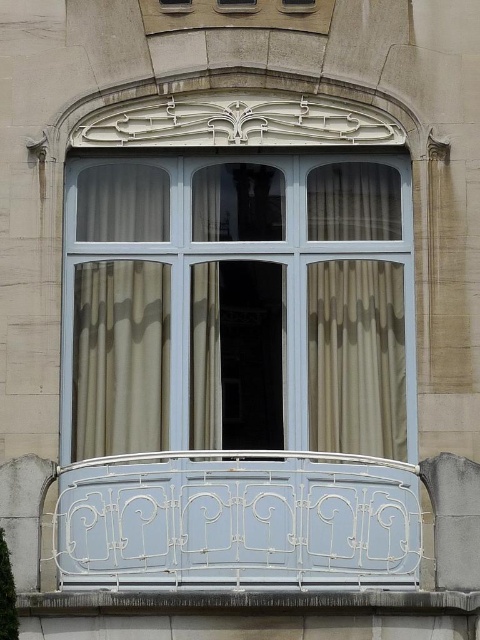
Looking at this image, does beige textured curtain at center have a larger size compared to beige sheer curtain at left?

Incorrect, beige textured curtain at center is not larger than beige sheer curtain at left.

Does beige textured curtain at center appear over beige sheer curtain at left?

Yes, beige textured curtain at center is above beige sheer curtain at left.

Does point (363, 291) come closer to viewer compared to point (113, 237)?

Yes, point (363, 291) is in front of point (113, 237).

Where is `beige textured curtain at center`? Image resolution: width=480 pixels, height=640 pixels. beige textured curtain at center is located at coordinates 357,356.

Between white wrought iron balcony at lower center and silky beige curtain at center, which one is positioned lower?

white wrought iron balcony at lower center is below.

Locate an element on the screen. Image resolution: width=480 pixels, height=640 pixels. white wrought iron balcony at lower center is located at coordinates (238, 518).

You are a GUI agent. You are given a task and a screenshot of the screen. Output one action in this format:
    pyautogui.click(x=<x>, y=<y>)
    Task: Click on the white wrought iron balcony at lower center
    The height and width of the screenshot is (640, 480).
    Given the screenshot: What is the action you would take?
    pyautogui.click(x=238, y=518)

Which is in front, point (220, 602) or point (192, 209)?

Point (220, 602) is more forward.

Can you confirm if concrete at lower center is smaller than silky beige curtain at center?

Actually, concrete at lower center might be larger than silky beige curtain at center.

Is point (336, 596) farther from camera compared to point (219, 211)?

No.

Image resolution: width=480 pixels, height=640 pixels. I want to click on concrete at lower center, so click(x=245, y=602).